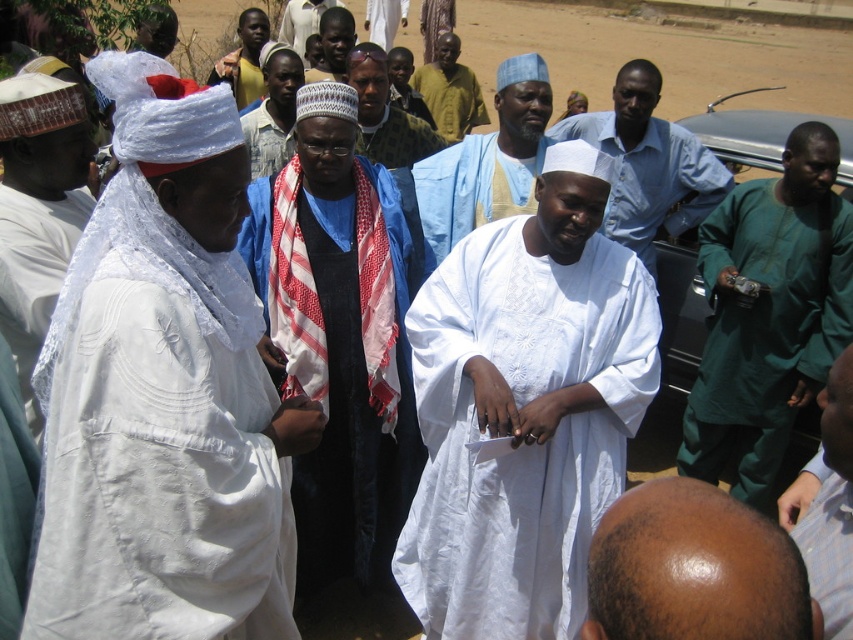
What do you see at coordinates (488, 161) in the screenshot? I see `light blue fabric at center` at bounding box center [488, 161].

Is light blue fabric at center taller than white cotton turban at center?

No.

The height and width of the screenshot is (640, 853). What do you see at coordinates (488, 161) in the screenshot? I see `light blue fabric at center` at bounding box center [488, 161].

The image size is (853, 640). Identify the location of light blue fabric at center. (488, 161).

Can you confirm if white cotton turban at center is bigger than yellow textured shirt at center?

Incorrect, white cotton turban at center is not larger than yellow textured shirt at center.

The height and width of the screenshot is (640, 853). Find the location of `white cotton turban at center`. white cotton turban at center is located at coordinates (273, 113).

Which of these two, light blue fabric at center or yellow textured shirt at center, stands taller?

yellow textured shirt at center is taller.

Does point (442, 230) come farther from viewer compared to point (459, 106)?

No, it is not.

Is point (506, 209) more distant than point (456, 68)?

No, (506, 209) is in front of (456, 68).

I want to click on light blue fabric at center, so click(488, 161).